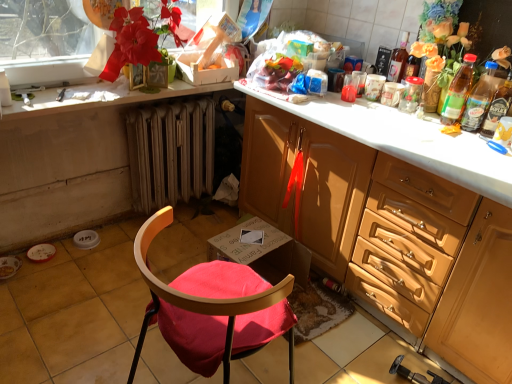
Locate an element on the screen. free space to the left of translucent plastic bottle at upper right, which appears as the third bottle when viewed from the right is located at coordinates (417, 118).